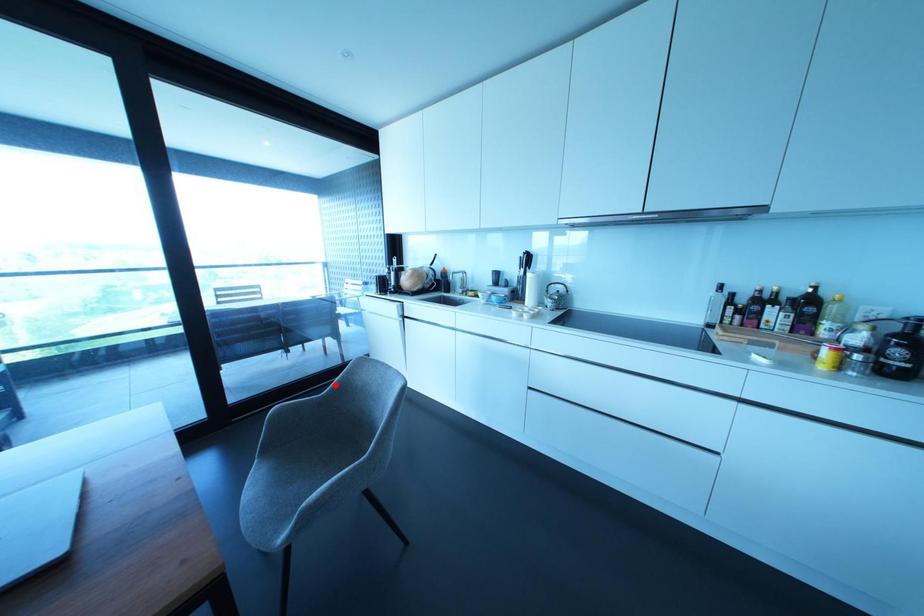
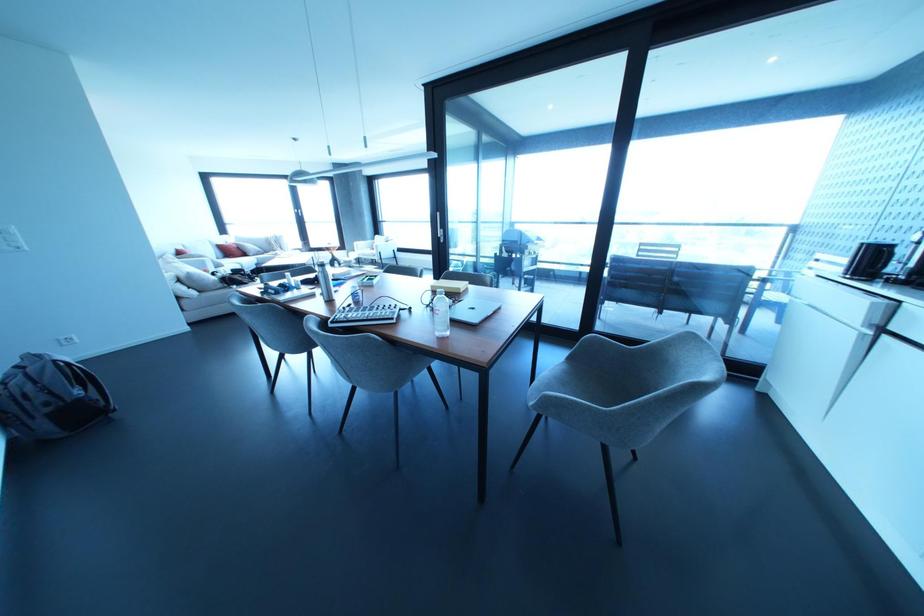
In the second image, find the point that corresponds to the highlighted location in the first image.

(646, 346)